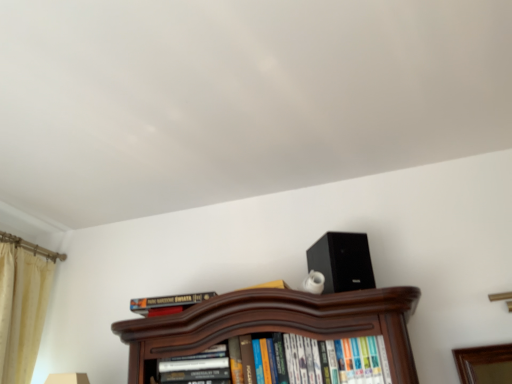
Image resolution: width=512 pixels, height=384 pixels. What are the coordinates of `black matte speaker at upper right` in the screenshot? It's located at (342, 261).

Describe the element at coordinates (22, 310) in the screenshot. Image resolution: width=512 pixels, height=384 pixels. I see `beige velvet curtain at left` at that location.

The image size is (512, 384). What do you see at coordinates (284, 362) in the screenshot? I see `hardcover books at center, the 1th book from the right` at bounding box center [284, 362].

What is the approximate width of hardcover book at center, positioned as the 2th book in left-to-right order?

5.58 inches.

The height and width of the screenshot is (384, 512). I want to click on black matte speaker at upper right, so click(x=342, y=261).

Is hardcover book at center, which ranks as the 2th book in right-to-left order, surrounded by hardcover books at center, which ranks as the third book in left-to-right order?

That's incorrect, hardcover book at center, which ranks as the 2th book in right-to-left order, is not inside hardcover books at center, which ranks as the third book in left-to-right order.

Is hardcover books at center, which ranks as the third book in left-to-right order, wider or thinner than hardcover book at center, positioned as the 2th book in left-to-right order?

hardcover books at center, which ranks as the third book in left-to-right order, is wider than hardcover book at center, positioned as the 2th book in left-to-right order.

Considering the relative positions of hardcover books at center, which ranks as the third book in left-to-right order, and hardcover book at center, which ranks as the 2th book in right-to-left order, in the image provided, is hardcover books at center, which ranks as the third book in left-to-right order, to the left of hardcover book at center, which ranks as the 2th book in right-to-left order, from the viewer's perspective?

No, hardcover books at center, which ranks as the third book in left-to-right order, is not to the left of hardcover book at center, which ranks as the 2th book in right-to-left order.

Is hardcover books at center, which ranks as the third book in left-to-right order, in front of or behind hardcover book at center, which ranks as the 2th book in right-to-left order, in the image?

hardcover books at center, which ranks as the third book in left-to-right order, is positioned closer to the viewer than hardcover book at center, which ranks as the 2th book in right-to-left order.

How different are the orientations of beige velvet curtain at left and hardcover books at center, which ranks as the third book in left-to-right order, in degrees?

98.2 degrees.

From the image's perspective, is beige velvet curtain at left under hardcover books at center, the 1th book from the right?

Incorrect, from the image's perspective, beige velvet curtain at left is higher than hardcover books at center, the 1th book from the right.

Is beige velvet curtain at left taller than hardcover books at center, which ranks as the third book in left-to-right order?

Indeed, beige velvet curtain at left has a greater height compared to hardcover books at center, which ranks as the third book in left-to-right order.

Is beige velvet curtain at left located outside hardcover books at center, which ranks as the third book in left-to-right order?

Indeed, beige velvet curtain at left is completely outside hardcover books at center, which ranks as the third book in left-to-right order.

From a real-world perspective, does hardcover book at center, which ranks as the 2th book in right-to-left order, stand above hardcover books at center, which ranks as the third book in left-to-right order?

No.

Considering the sizes of hardcover book at center, which ranks as the 2th book in right-to-left order, and hardcover books at center, the 1th book from the right, in the image, is hardcover book at center, which ranks as the 2th book in right-to-left order, wider or thinner than hardcover books at center, the 1th book from the right,?

Clearly, hardcover book at center, which ranks as the 2th book in right-to-left order, has less width compared to hardcover books at center, the 1th book from the right.

Which point is more distant from viewer, (192, 371) or (170, 372)?

The point (170, 372) is more distant.

Is hardcover book at center, positioned as the 2th book in left-to-right order, facing away from hardcover books at center, the 1th book from the right?

No, hardcover book at center, positioned as the 2th book in left-to-right order, is not facing the opposite direction of hardcover books at center, the 1th book from the right.

Which is more to the right, black matte speaker at upper right or hardcover book at center, which ranks as the 2th book in right-to-left order?

Positioned to the right is black matte speaker at upper right.

Is black matte speaker at upper right aimed at hardcover book at center, positioned as the 2th book in left-to-right order?

No, black matte speaker at upper right is not aimed at hardcover book at center, positioned as the 2th book in left-to-right order.

From the image's perspective, which one is positioned higher, black matte speaker at upper right or hardcover book at center, which ranks as the 2th book in right-to-left order?

black matte speaker at upper right.

Could you measure the distance between black matte speaker at upper right and hardcover book at center, positioned as the 2th book in left-to-right order?

A distance of 19.97 inches exists between black matte speaker at upper right and hardcover book at center, positioned as the 2th book in left-to-right order.

Considering the relative sizes of hardcover book at center, which ranks as the 2th book in right-to-left order, and hardcover book at center, arranged as the third book when viewed from the right, in the image provided, is hardcover book at center, which ranks as the 2th book in right-to-left order, taller than hardcover book at center, arranged as the third book when viewed from the right,?

Indeed, hardcover book at center, which ranks as the 2th book in right-to-left order, has a greater height compared to hardcover book at center, arranged as the third book when viewed from the right.

Which object is positioned more to the right, hardcover book at center, positioned as the 2th book in left-to-right order, or hardcover book at center, arranged as the third book when viewed from the right?

hardcover book at center, positioned as the 2th book in left-to-right order.

Between hardcover book at center, which ranks as the 2th book in right-to-left order, and hardcover book at center, arranged as the third book when viewed from the right, which one has larger width?

Wider between the two is hardcover book at center, arranged as the third book when viewed from the right.

From a real-world perspective, who is located higher, hardcover book at center, positioned as the 2th book in left-to-right order, or hardcover book at center, arranged as the third book when viewed from the right?

hardcover book at center, arranged as the third book when viewed from the right.

How many degrees apart are the facing directions of beige velvet curtain at left and hardcover book at center, marked as the 1th book in a left-to-right arrangement?

88.7 degrees separate the facing orientations of beige velvet curtain at left and hardcover book at center, marked as the 1th book in a left-to-right arrangement.

Considering the positions of point (0, 318) and point (188, 304), is point (0, 318) closer or farther from the camera than point (188, 304)?

Point (0, 318) is farther from the camera than point (188, 304).

From the image's perspective, which one is positioned lower, beige velvet curtain at left or hardcover book at center, arranged as the third book when viewed from the right?

beige velvet curtain at left, from the image's perspective.

Could you tell me if beige velvet curtain at left is facing hardcover book at center, arranged as the third book when viewed from the right?

Yes, beige velvet curtain at left is turned towards hardcover book at center, arranged as the third book when viewed from the right.

From the picture: Considering the relative sizes of black matte speaker at upper right and hardcover books at center, the 1th book from the right, in the image provided, is black matte speaker at upper right thinner than hardcover books at center, the 1th book from the right,?

Yes.

Which object is more forward, black matte speaker at upper right or hardcover books at center, the 1th book from the right?

hardcover books at center, the 1th book from the right, is closer to the camera.

Would you say black matte speaker at upper right is to the left or to the right of hardcover books at center, which ranks as the third book in left-to-right order, in the picture?

black matte speaker at upper right is positioned on hardcover books at center, which ranks as the third book in left-to-right order,'s right side.

You are a GUI agent. You are given a task and a screenshot of the screen. Output one action in this format:
    pyautogui.click(x=<x>, y=<y>)
    Task: Click on the 2nd book directly beneath the black matte speaker at upper right (from a real-world perspective)
    
    Given the screenshot: What is the action you would take?
    pyautogui.click(x=284, y=362)

Find the location of a particular element. the 1st book behind when counting from the hardcover books at center, which ranks as the third book in left-to-right order is located at coordinates pyautogui.click(x=196, y=366).

Locate an element on the screen. the 2nd book positioned below the beige velvet curtain at left (from a real-world perspective) is located at coordinates (284, 362).

Estimate the real-world distances between objects in this image. Which object is closer to beige velvet curtain at left, hardcover book at center, which ranks as the 2th book in right-to-left order, or hardcover book at center, marked as the 1th book in a left-to-right arrangement?

hardcover book at center, marked as the 1th book in a left-to-right arrangement, is positioned closer to the anchor beige velvet curtain at left.

When comparing their distances from hardcover book at center, positioned as the 2th book in left-to-right order, does hardcover book at center, arranged as the third book when viewed from the right, or beige velvet curtain at left seem further?

Based on the image, beige velvet curtain at left appears to be further to hardcover book at center, positioned as the 2th book in left-to-right order.

From the image, which object appears to be nearer to hardcover book at center, which ranks as the 2th book in right-to-left order, beige velvet curtain at left or hardcover book at center, marked as the 1th book in a left-to-right arrangement?

Based on the image, hardcover book at center, marked as the 1th book in a left-to-right arrangement, appears to be nearer to hardcover book at center, which ranks as the 2th book in right-to-left order.

Considering their positions, is beige velvet curtain at left positioned closer to hardcover books at center, the 1th book from the right, than hardcover book at center, which ranks as the 2th book in right-to-left order?

The object closer to hardcover books at center, the 1th book from the right, is hardcover book at center, which ranks as the 2th book in right-to-left order.

Estimate the real-world distances between objects in this image. Which object is further from hardcover books at center, the 1th book from the right, hardcover book at center, marked as the 1th book in a left-to-right arrangement, or beige velvet curtain at left?

beige velvet curtain at left.

Considering their positions, is black matte speaker at upper right positioned further to hardcover book at center, marked as the 1th book in a left-to-right arrangement, than hardcover books at center, the 1th book from the right?

black matte speaker at upper right is positioned further to the anchor hardcover book at center, marked as the 1th book in a left-to-right arrangement.

Estimate the real-world distances between objects in this image. Which object is closer to hardcover books at center, the 1th book from the right, hardcover book at center, which ranks as the 2th book in right-to-left order, or hardcover book at center, marked as the 1th book in a left-to-right arrangement?

hardcover book at center, which ranks as the 2th book in right-to-left order, is closer to hardcover books at center, the 1th book from the right.

From the image, which object appears to be farther from hardcover books at center, the 1th book from the right, black matte speaker at upper right or hardcover book at center, arranged as the third book when viewed from the right?

hardcover book at center, arranged as the third book when viewed from the right.

Find the location of a particular element. The image size is (512, 384). book between beige velvet curtain at left and hardcover book at center, which ranks as the 2th book in right-to-left order is located at coordinates (167, 301).

The image size is (512, 384). I want to click on book located between hardcover book at center, which ranks as the 2th book in right-to-left order, and black matte speaker at upper right in the left-right direction, so click(x=284, y=362).

The height and width of the screenshot is (384, 512). Identify the location of book located between hardcover book at center, arranged as the third book when viewed from the right, and hardcover books at center, which ranks as the third book in left-to-right order, in the left-right direction. (196, 366).